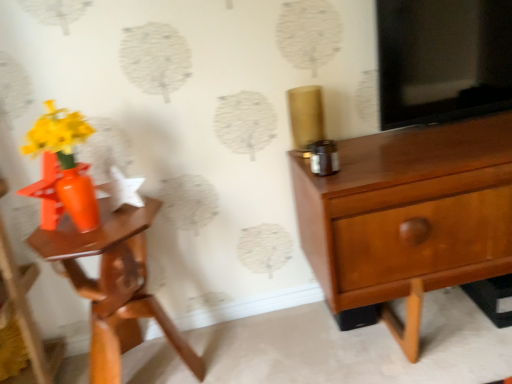
Identify the location of vacant space in matte wood chest of drawers at right (from a real-world perspective). This screenshot has height=384, width=512. (424, 347).